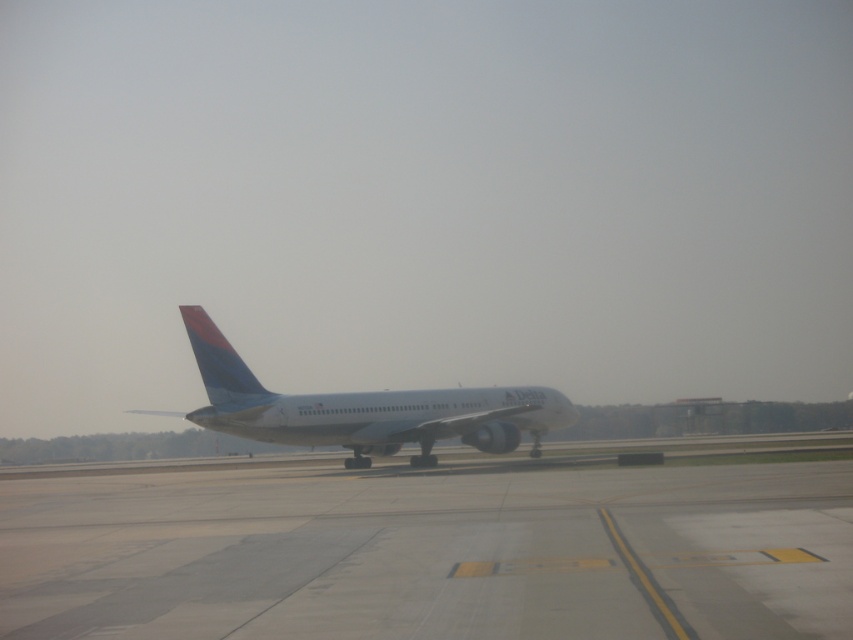
Question: Which point is farther from the camera taking this photo?

Choices:
 (A) (746, 572)
 (B) (252, 390)

Answer: (B)

Question: Among these objects, which one is farthest from the camera?

Choices:
 (A) gray concrete tarmac at center
 (B) white glossy airplane at center

Answer: (B)

Question: Is the position of gray concrete tarmac at center more distant than that of white glossy airplane at center?

Choices:
 (A) yes
 (B) no

Answer: (B)

Question: Can you confirm if gray concrete tarmac at center is bigger than white glossy airplane at center?

Choices:
 (A) yes
 (B) no

Answer: (B)

Question: Can you confirm if gray concrete tarmac at center is wider than white glossy airplane at center?

Choices:
 (A) yes
 (B) no

Answer: (B)

Question: Among these objects, which one is farthest from the camera?

Choices:
 (A) gray concrete tarmac at center
 (B) white glossy airplane at center

Answer: (B)